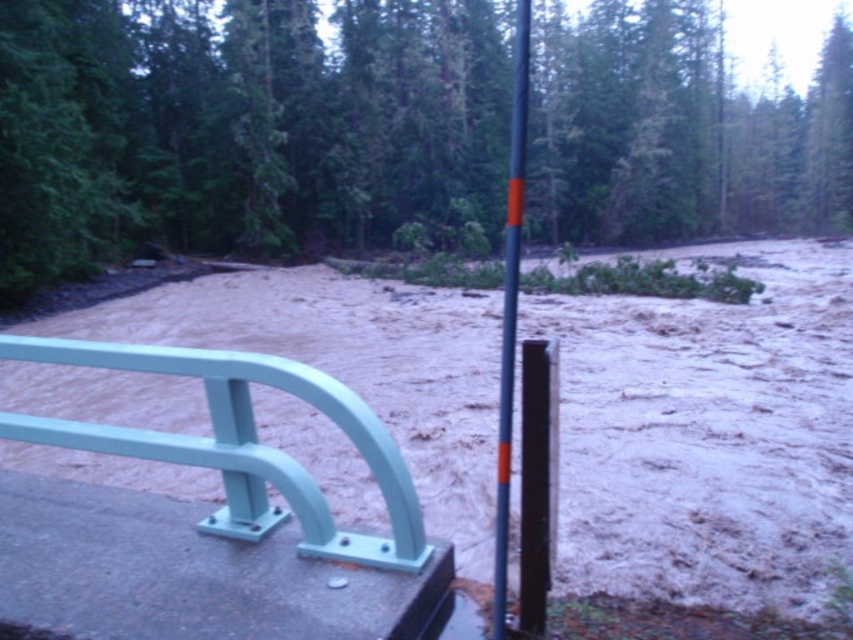
You are standing on the bridge looking at the flooded area. There are two points marked in the image, one at coordinates point (252,16) and the other at point (511,433). Which point is closer to you?

Point (252,16) is closer to you because it is further to the camera than point (511,433).